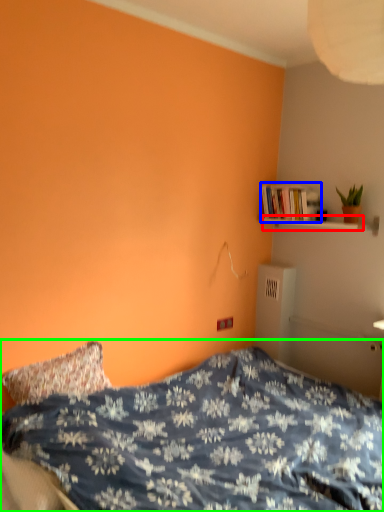
Question: Which is nearer to the shelf (highlighted by a red box)? book (highlighted by a blue box) or bed (highlighted by a green box).

Choices:
 (A) book
 (B) bed

Answer: (A)